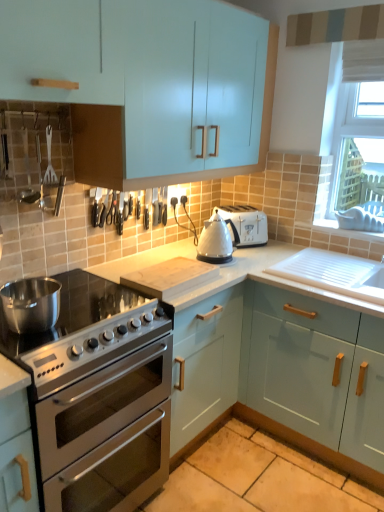
I want to click on free space in front of white glossy kettle at center, the second appliance ordered from the bottom, so click(228, 270).